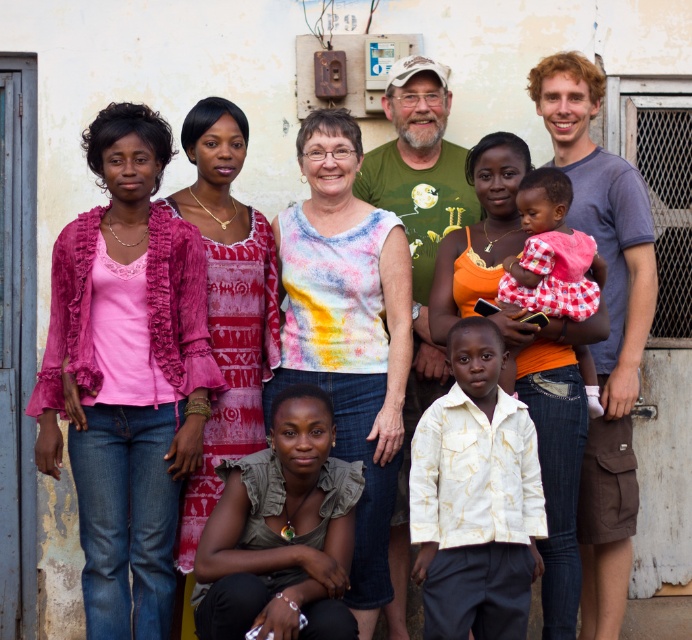
Question: Which object is farther from the camera taking this photo?

Choices:
 (A) white printed shirt at center
 (B) tie-dye fabric shirt at center

Answer: (B)

Question: Can you confirm if white printed shirt at center is positioned below green textured t-shirt at center?

Choices:
 (A) yes
 (B) no

Answer: (A)

Question: Among these objects, which one is nearest to the camera?

Choices:
 (A) tie-dye fabric shirt at center
 (B) white printed shirt at center

Answer: (B)

Question: From the image, what is the correct spatial relationship of green textured t-shirt at center in relation to red checkered dress at center?

Choices:
 (A) above
 (B) below

Answer: (B)

Question: Is green textured t-shirt at center smaller than red checkered dress at center?

Choices:
 (A) no
 (B) yes

Answer: (A)

Question: Which object is the farthest from the white printed shirt at center?

Choices:
 (A) red checkered dress at center
 (B) tie-dye fabric shirt at center
 (C) green textured t-shirt at center

Answer: (C)